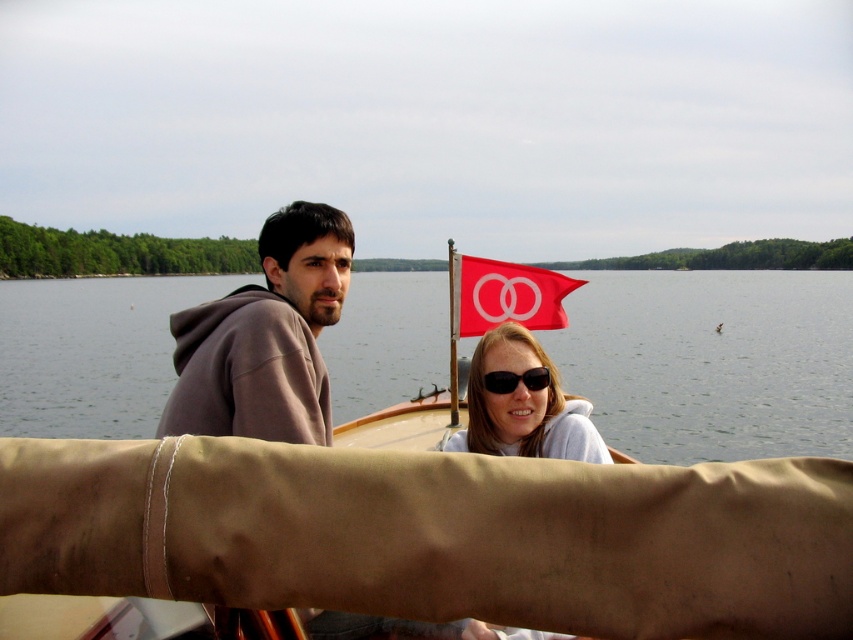
You are a photographer taking a picture of the matte white sunglasses at center and the black plastic sunglasses at center on a boat. Which pair of sunglasses is positioned lower in the frame?

The matte white sunglasses at center is below black plastic sunglasses at center, so the matte white sunglasses at center is positioned lower in the frame.

You are a photographer on the boat and want to take a photo of the brown hoodie at center and the matte white sunglasses at center. Which object should you focus on first if you want to capture both in one shot without moving the camera?

The brown hoodie at center is to the left of matte white sunglasses at center, so you should focus on the brown hoodie at center first to ensure both are in frame.

From the picture: You are a photographer trying to capture the perfect shot of the two pairs of sunglasses on the table. You notice that one pair is matte white and the other is black plastic. According to the scene description, which direction should you adjust your camera to focus on the matte white sunglasses at center first before the black plastic sunglasses at center?

The matte white sunglasses at center are to the right of the black plastic sunglasses at center, so you should adjust your camera to the right to focus on the matte white sunglasses at center first.